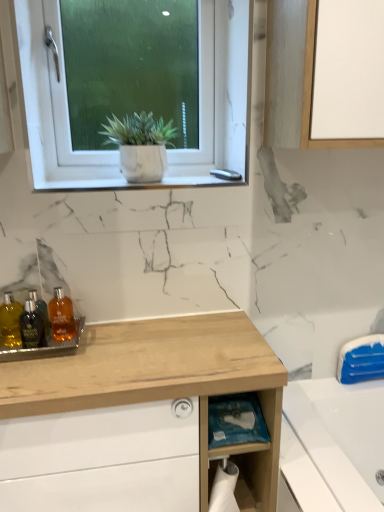
You are a GUI agent. You are given a task and a screenshot of the screen. Output one action in this format:
    pyautogui.click(x=<x>, y=<y>)
    Task: Click on the free point in front of translucent amber bottle at center, placed as the third toiletry when sorted from left to right
    
    Given the screenshot: What is the action you would take?
    pyautogui.click(x=59, y=375)